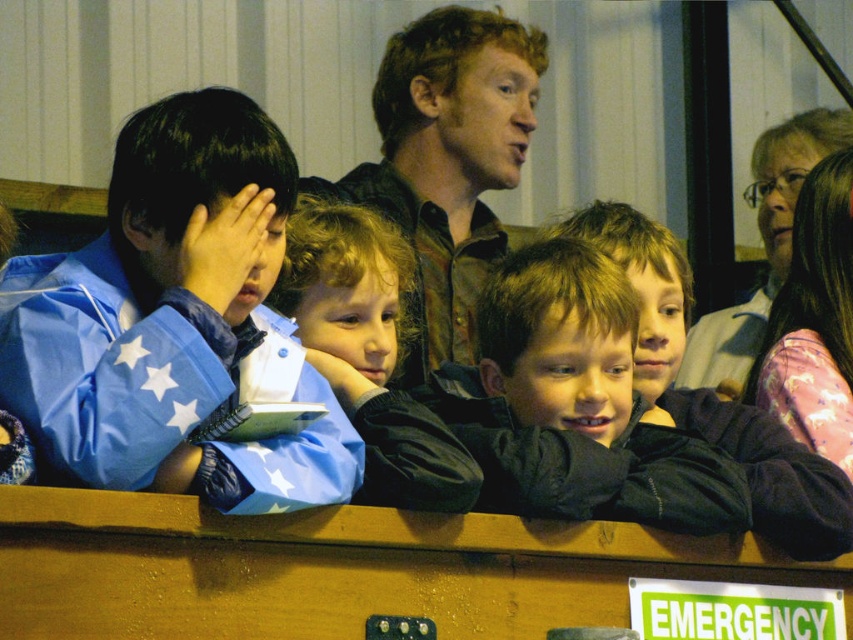
You are an event organizer arranging chairs for a small gathering. You have two items to place on a shelf next to each other. The blue matte jacket at left and the light brown hair at center. Given their widths, which one should you place first to ensure they fit properly?

The blue matte jacket at left is wider than the light brown hair at center, so you should place the blue matte jacket at left first to ensure they fit properly on the shelf.

You are a photographer trying to capture a candid shot of the blue matte jacket at left and the light brown hair at center. Since you want to ensure both subjects are in focus, which one should you adjust your camera focus on first considering their sizes?

The blue matte jacket at left is bigger than the light brown hair at center, so you should focus on the blue matte jacket at left first to ensure both are in focus.

You are a costume designer preparing for a school play. You have two jackets available for the main character. The first is a dark brown fabric jacket at center, and the second is a dark brown velvety jacket at center. Which jacket would you choose if you want the costume to look more compact and less bulky?

The dark brown fabric jacket at center is shorter than the dark brown velvety jacket at center, so choosing the dark brown fabric jacket at center would make the costume look more compact and less bulky.